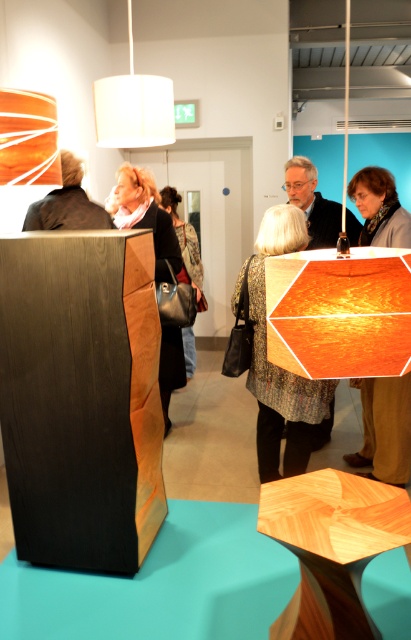
Question: Can you confirm if patterned fabric jacket at center is positioned to the left of matte orange hexagonal lampshade at center?

Choices:
 (A) yes
 (B) no

Answer: (A)

Question: Is the position of patterned fabric jacket at center more distant than that of matte orange hexagonal lampshade at center?

Choices:
 (A) no
 (B) yes

Answer: (A)

Question: Which object is the closest to the leather handbag at center?

Choices:
 (A) matte brown coat at center
 (B) white fabric lampshade at upper center
 (C) matte black jacket at upper left

Answer: (A)

Question: Does matte orange hexagonal lampshade at center have a larger size compared to white fabric lampshade at upper center?

Choices:
 (A) no
 (B) yes

Answer: (B)

Question: Which point is farther from the camera taking this photo?

Choices:
 (A) (140, 225)
 (B) (60, 179)
 (C) (371, 472)
 (D) (325, 214)

Answer: (D)

Question: Which point appears farthest from the camera in this image?

Choices:
 (A) (30, 104)
 (B) (298, 173)

Answer: (B)